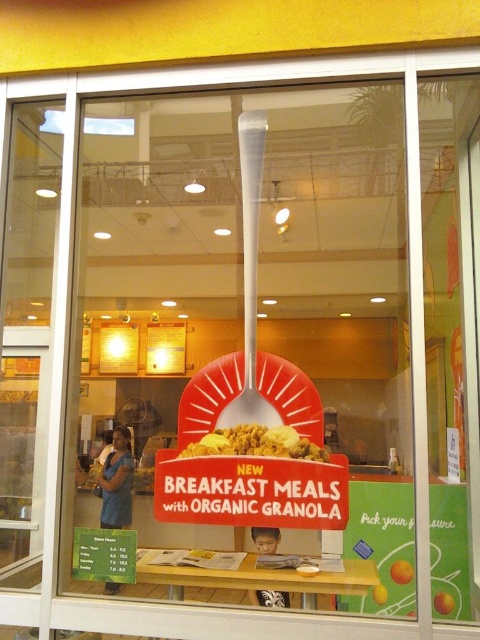
Identify the location of white plastic shovel at center. (250, 275).

Between white plastic shovel at center and yellow matte cereal bowl at center, which one has more height?

white plastic shovel at center

Who is more distant from viewer, [241,128] or [316,445]?

The point [241,128] is more distant.

Find the location of a particular element. white plastic shovel at center is located at coordinates (250, 275).